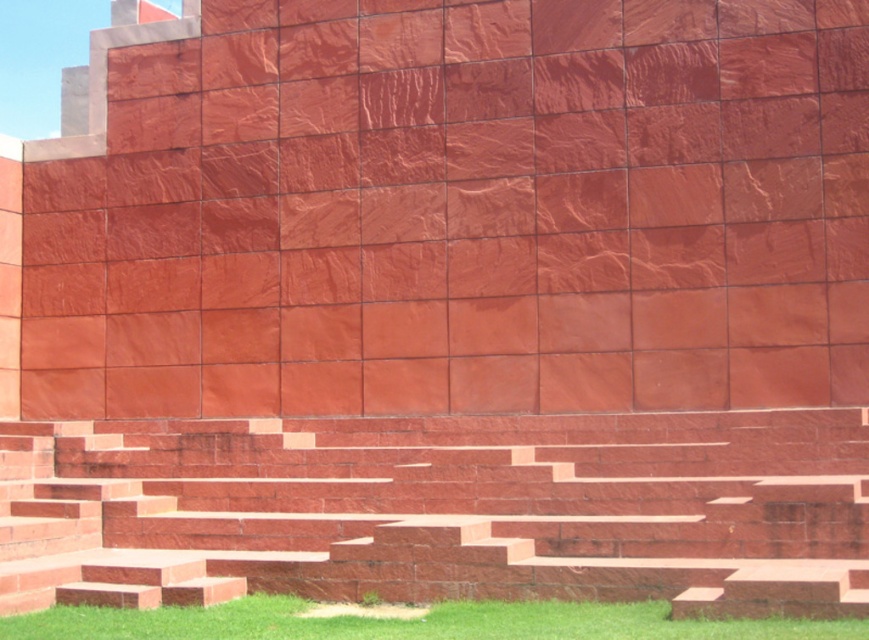
Question: Which object is closer to the camera taking this photo?

Choices:
 (A) matte red stone wall at center
 (B) green grass at lower center
 (C) polished red stone stairs at center

Answer: (C)

Question: Does matte red stone wall at center appear under polished red stone stairs at center?

Choices:
 (A) no
 (B) yes

Answer: (A)

Question: In this image, where is matte red stone wall at center located relative to polished red stone stairs at center?

Choices:
 (A) below
 (B) above

Answer: (B)

Question: Which object appears farthest from the camera in this image?

Choices:
 (A) green grass at lower center
 (B) matte red stone wall at center
 (C) polished red stone stairs at center

Answer: (B)

Question: Which point is farther to the camera?

Choices:
 (A) polished red stone stairs at center
 (B) green grass at lower center

Answer: (B)

Question: Is matte red stone wall at center below polished red stone stairs at center?

Choices:
 (A) no
 (B) yes

Answer: (A)